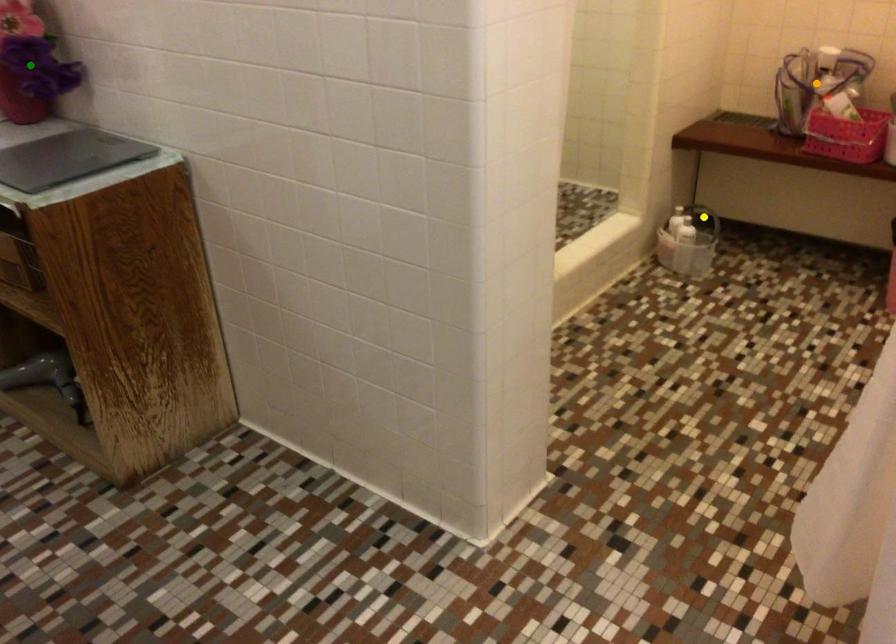
Order these from farthest to nearest:
A) yellow point
B) orange point
C) green point

yellow point → orange point → green point